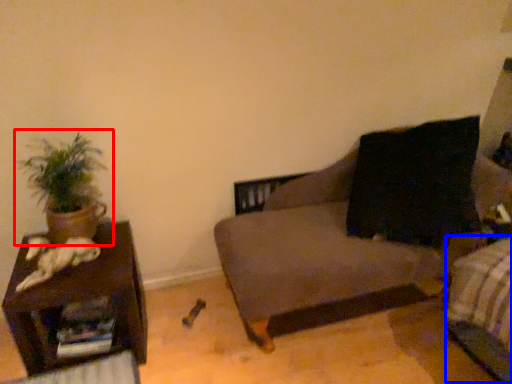
Question: Which of the following is the farthest to the observer, houseplant (highlighted by a red box) or bed frame (highlighted by a blue box)?

Choices:
 (A) houseplant
 (B) bed frame

Answer: (A)